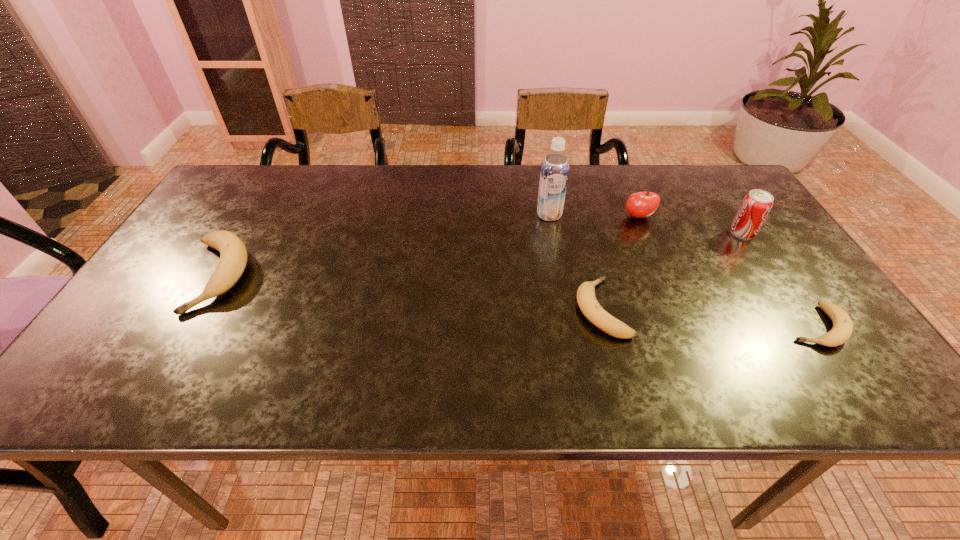
At what (x,y) coordinates should I click in order to perform the action: click on the third tallest object. Please return your answer as a coordinate pair (x, y). The image size is (960, 540). Looking at the image, I should click on (641, 204).

The width and height of the screenshot is (960, 540). I want to click on vacant space situated on the right of the leftmost object, so click(367, 276).

I want to click on vacant space positioned on the back of the second tallest banana, so click(x=584, y=241).

I want to click on vacant space situated 0.050m on the left of the shortest banana, so click(x=763, y=326).

Where is `free space located on the back of the fifth shortest object`? free space located on the back of the fifth shortest object is located at coordinates (701, 169).

The image size is (960, 540). What are the coordinates of `free space located 0.160m on the label of the soya milk` in the screenshot? It's located at (558, 261).

At what (x,y) coordinates should I click in order to perform the action: click on vacant space positioned 0.400m on the left of the apple. Please return your answer as a coordinate pair (x, y). The width and height of the screenshot is (960, 540). Looking at the image, I should click on (481, 217).

Locate an element on the screen. Image resolution: width=960 pixels, height=540 pixels. soya milk at the far edge is located at coordinates (554, 174).

Identify the location of apple present at the far edge. The image size is (960, 540). (641, 204).

Locate an element on the screen. The width and height of the screenshot is (960, 540). object present at the left edge is located at coordinates (233, 255).